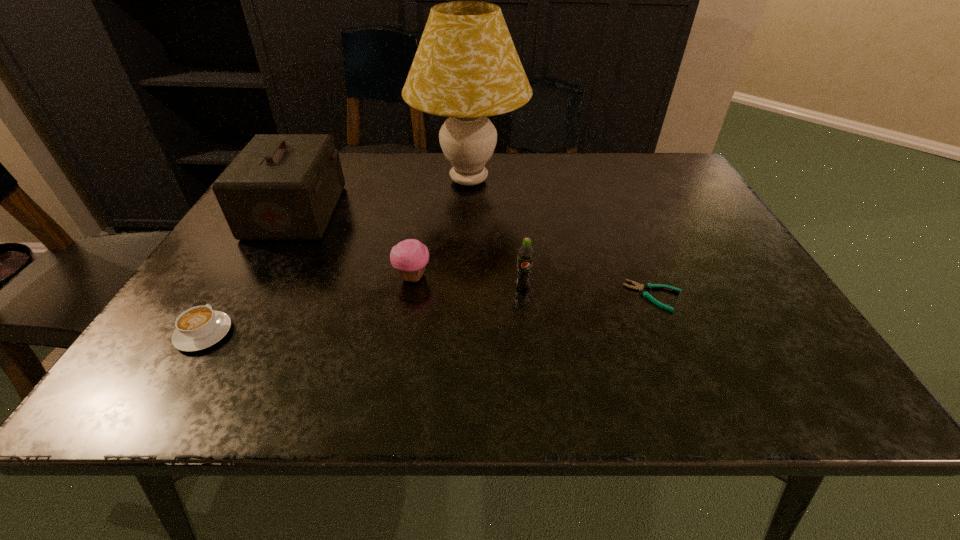
Where is `vacant space that satisfies the following two spatial constraints: 1. on the front label of the soda; 2. on the right side of the rightmost object`? Image resolution: width=960 pixels, height=540 pixels. vacant space that satisfies the following two spatial constraints: 1. on the front label of the soda; 2. on the right side of the rightmost object is located at coordinates (524, 296).

Where is `blank space that satisfies the following two spatial constraints: 1. on the front side of the tallest object; 2. on the right side of the shortest object`? The width and height of the screenshot is (960, 540). blank space that satisfies the following two spatial constraints: 1. on the front side of the tallest object; 2. on the right side of the shortest object is located at coordinates (465, 296).

Identify the location of vacant space that satisfies the following two spatial constraints: 1. on the side of the first-aid kit with the handle; 2. on the right side of the cappuccino. (277, 212).